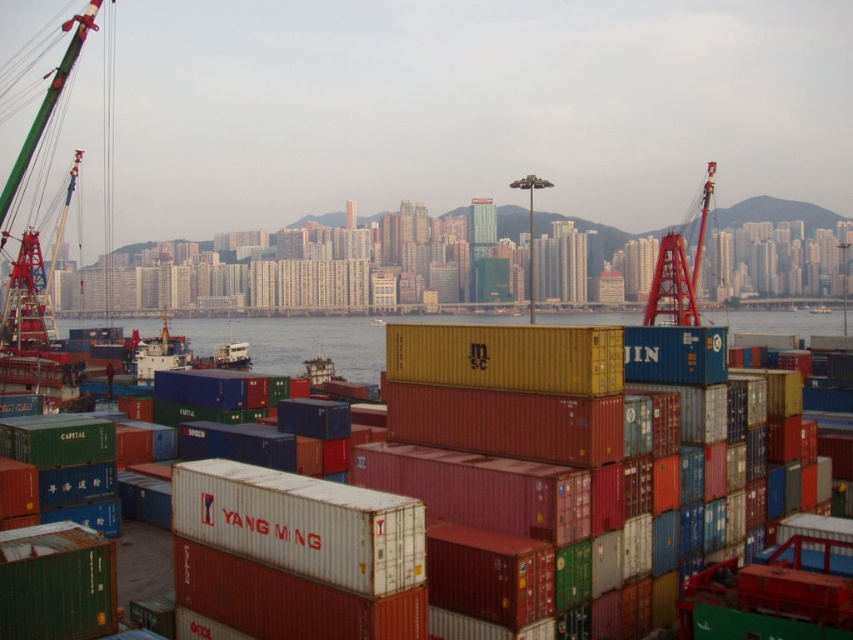
Between blue water at center and red metallic crane at right, which one is positioned higher?

red metallic crane at right

Does blue water at center have a greater height compared to red metallic crane at right?

No.

Which is in front, point (415, 316) or point (660, 237)?

Point (415, 316) is more forward.

Identify the location of blue water at center. (294, 340).